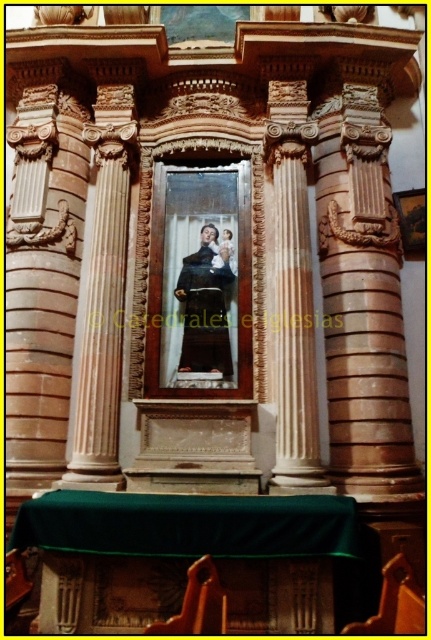
Measure the distance between brown polished stone column at right and camera.

A distance of 7.07 meters exists between brown polished stone column at right and camera.

Does point (368, 333) come behind point (197, 282)?

No.

Locate an element on the screen. The width and height of the screenshot is (431, 640). brown polished stone column at right is located at coordinates (362, 296).